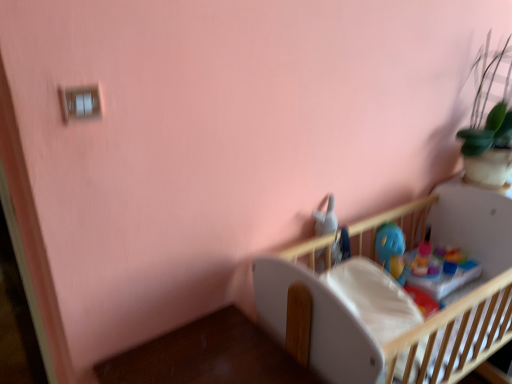
Question: From a real-world perspective, is blue plastic toy at upper center positioned under wooden crib at center based on gravity?

Choices:
 (A) no
 (B) yes

Answer: (A)

Question: Can you confirm if blue plastic toy at upper center is thinner than wooden crib at center?

Choices:
 (A) no
 (B) yes

Answer: (B)

Question: From the image's perspective, is blue plastic toy at upper center on top of wooden crib at center?

Choices:
 (A) no
 (B) yes

Answer: (B)

Question: Can we say blue plastic toy at upper center lies outside wooden crib at center?

Choices:
 (A) yes
 (B) no

Answer: (B)

Question: Does blue plastic toy at upper center turn towards wooden crib at center?

Choices:
 (A) no
 (B) yes

Answer: (B)

Question: Is blue plastic toy at upper center closer to the viewer compared to wooden crib at center?

Choices:
 (A) no
 (B) yes

Answer: (A)

Question: Is white matte table at lower right positioned behind blue plastic toy at upper center?

Choices:
 (A) no
 (B) yes

Answer: (A)

Question: From the image's perspective, is white matte table at lower right over blue plastic toy at upper center?

Choices:
 (A) no
 (B) yes

Answer: (A)

Question: Does white matte table at lower right appear on the right side of blue plastic toy at upper center?

Choices:
 (A) no
 (B) yes

Answer: (A)

Question: Would you say white matte table at lower right is outside blue plastic toy at upper center?

Choices:
 (A) no
 (B) yes

Answer: (B)

Question: Does white matte table at lower right have a lesser height compared to blue plastic toy at upper center?

Choices:
 (A) yes
 (B) no

Answer: (B)

Question: Is white matte table at lower right surrounding blue plastic toy at upper center?

Choices:
 (A) yes
 (B) no

Answer: (B)

Question: Considering the relative positions of white matte table at lower right and wooden crib at center in the image provided, is white matte table at lower right to the right of wooden crib at center from the viewer's perspective?

Choices:
 (A) yes
 (B) no

Answer: (B)